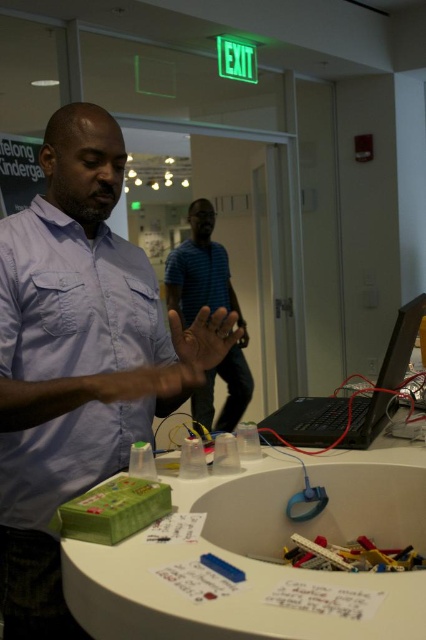
Question: Does matte blue shirt at center have a greater width compared to black matte laptop at right?

Choices:
 (A) no
 (B) yes

Answer: (B)

Question: Can you confirm if matte blue shirt at center is positioned below blue striped shirt at center?

Choices:
 (A) no
 (B) yes

Answer: (B)

Question: Which object is farther from the camera taking this photo?

Choices:
 (A) black matte laptop at right
 (B) white plastic table at center
 (C) matte blue shirt at left

Answer: (A)

Question: Which point is closer to the camera?

Choices:
 (A) (147, 604)
 (B) (340, 410)
 (C) (89, 486)

Answer: (A)

Question: Which object is farther from the camera taking this photo?

Choices:
 (A) blue striped shirt at center
 (B) matte blue shirt at center
 (C) black matte laptop at right
 (D) white plastic table at center

Answer: (A)

Question: Is white plastic table at center wider than black matte laptop at right?

Choices:
 (A) no
 (B) yes

Answer: (B)